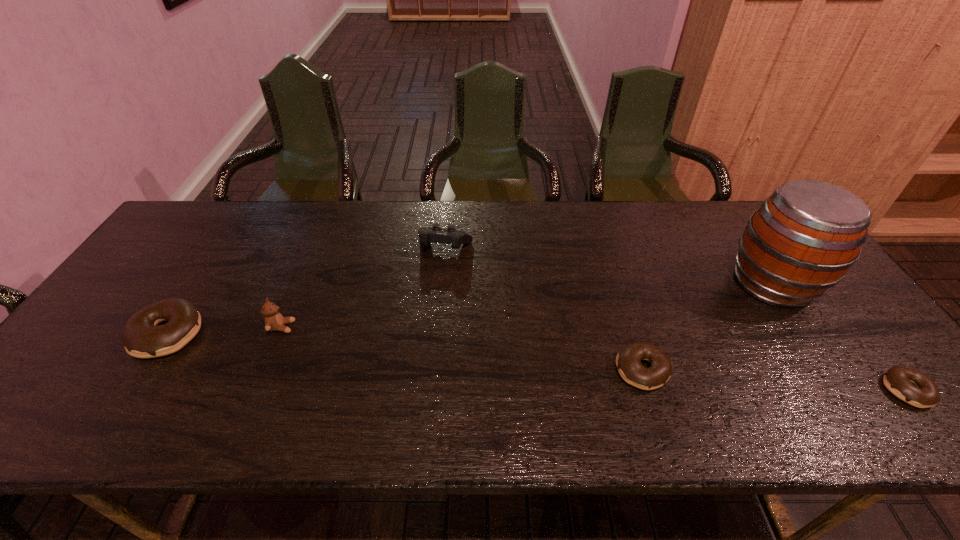
Find the location of a particular element. The width and height of the screenshot is (960, 540). vacant space that's between the fifth object from right to left and the third tallest object is located at coordinates (364, 287).

Identify the location of free spot between the third object from right to left and the tallest object. (708, 327).

Locate an element on the screen. vacant area that lies between the tallest doughnut and the shortest object is located at coordinates (538, 362).

Locate an element on the screen. This screenshot has height=540, width=960. free space between the fifth object from right to left and the cider is located at coordinates (527, 305).

At what (x,y) coordinates should I click in order to perform the action: click on free space between the tallest object and the fourth object from left to right. Please return your answer as a coordinate pair (x, y). Looking at the image, I should click on (708, 327).

Find the location of a particular element. This screenshot has width=960, height=540. free spot between the leftmost doughnut and the second doughnut from right to left is located at coordinates (405, 352).

Image resolution: width=960 pixels, height=540 pixels. What are the coordinates of `free space that is in between the fifth object from right to left and the shortest doughnut` in the screenshot? It's located at (594, 359).

The image size is (960, 540). In order to click on object identified as the second closest to the third object from right to left in this screenshot , I will do `click(436, 234)`.

Locate an element on the screen. This screenshot has width=960, height=540. object that stands as the third closest to the control is located at coordinates (142, 338).

Locate an element on the screen. This screenshot has height=540, width=960. doughnut object that ranks as the closest to the third object from right to left is located at coordinates (909, 385).